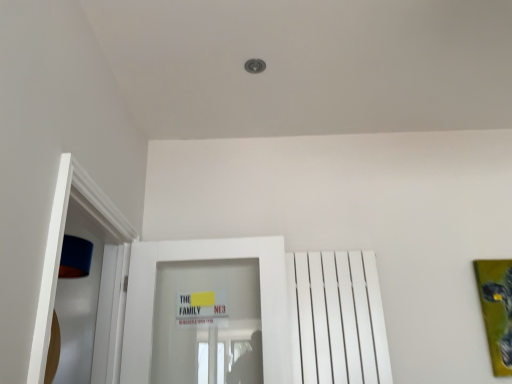
Measure the distance between green matte painting at right and camera.

green matte painting at right and camera are 2.13 meters apart from each other.

What is the approximate width of white matte radiator at right?

white matte radiator at right is 4.04 inches in width.

Where is `white glossy door at center`? The image size is (512, 384). white glossy door at center is located at coordinates (206, 259).

In the scene shown: Based on their positions, is white matte radiator at right located to the left or right of white glossy door at center?

In the image, white matte radiator at right appears on the right side of white glossy door at center.

Does white matte radiator at right have a greater width compared to white glossy door at center?

In fact, white matte radiator at right might be narrower than white glossy door at center.

From a real-world perspective, does white matte radiator at right stand above white glossy door at center?

No, from a real-world perspective, white matte radiator at right is not over white glossy door at center

Would you say white matte radiator at right is a long distance from white glossy door at center?

No.

Does white glossy door at center contain green matte painting at right?

Actually, green matte painting at right is outside white glossy door at center.

Can you tell me how much white glossy door at center and green matte painting at right differ in facing direction?

The angular difference between white glossy door at center and green matte painting at right is 1.62 degrees.

Which of these two, white glossy door at center or green matte painting at right, stands taller?

white glossy door at center.

Based on the photo, from the image's perspective, is green matte painting at right under white glossy door at center?

Indeed, from the image's perspective, green matte painting at right is shown beneath white glossy door at center.

Between point (498, 324) and point (282, 366), which one is positioned behind?

The point (498, 324) is more distant.

Is green matte painting at right not inside white glossy door at center?

green matte painting at right lies outside white glossy door at center's area.

From a real-world perspective, relative to white glossy door at center, is green matte painting at right vertically above or below?

green matte painting at right is situated lower than white glossy door at center in the real world.

Can you confirm if white matte radiator at right is bigger than green matte painting at right?

Yes.

From a real-world perspective, which object rests below the other?

green matte painting at right.

Is white matte radiator at right positioned beyond the bounds of green matte painting at right?

white matte radiator at right is positioned outside green matte painting at right.

In the scene shown: Is white matte radiator at right turned away from green matte painting at right?

No, green matte painting at right is not at the back of white matte radiator at right.

Is green matte painting at right further to camera compared to white matte radiator at right?

Yes, green matte painting at right is further from the viewer.

From a real-world perspective, is green matte painting at right under white matte radiator at right?

Yes, from a real-world perspective, green matte painting at right is below white matte radiator at right.

Locate an element on the screen. The width and height of the screenshot is (512, 384). radiator above the green matte painting at right (from the image's perspective) is located at coordinates (337, 319).

Can white matte radiator at right be found inside green matte painting at right?

No.

From the image's perspective, between white glossy door at center and white matte radiator at right, who is located below?

white matte radiator at right appears lower in the image.

Is white glossy door at center positioned far away from white matte radiator at right?

Actually, white glossy door at center and white matte radiator at right are a little close together.

Considering the sizes of white glossy door at center and white matte radiator at right in the image, is white glossy door at center wider or thinner than white matte radiator at right?

Considering their sizes, white glossy door at center looks broader than white matte radiator at right.

Is white glossy door at center positioned before white matte radiator at right?

Yes, white glossy door at center is in front of white matte radiator at right.

Identify the location of door that is above the white matte radiator at right (from a real-world perspective). The width and height of the screenshot is (512, 384). (206, 259).

Where is `picture frame that is below the white glossy door at center (from the image's perspective)`? picture frame that is below the white glossy door at center (from the image's perspective) is located at coordinates (497, 310).

In the scene shown: Which object lies nearer to the anchor point green matte painting at right, white matte radiator at right or white glossy door at center?

white matte radiator at right lies closer to green matte painting at right than the other object.

Looking at this image, from the image, which object appears to be farther from white matte radiator at right, white glossy door at center or green matte painting at right?

Among the two, green matte painting at right is located further to white matte radiator at right.

When comparing their distances from green matte painting at right, does white glossy door at center or white matte radiator at right seem closer?

white matte radiator at right is closer to green matte painting at right.

Considering their positions, is white matte radiator at right positioned further to white glossy door at center than green matte painting at right?

Among the two, green matte painting at right is located further to white glossy door at center.

Considering their positions, is green matte painting at right positioned further to white glossy door at center than white matte radiator at right?

green matte painting at right is further to white glossy door at center.

Which object lies further to the anchor point white matte radiator at right, green matte painting at right or white glossy door at center?

green matte painting at right is positioned further to the anchor white matte radiator at right.

At what (x,y) coordinates should I click in order to perform the action: click on radiator between white glossy door at center and green matte painting at right from left to right. Please return your answer as a coordinate pair (x, y). Looking at the image, I should click on (337, 319).